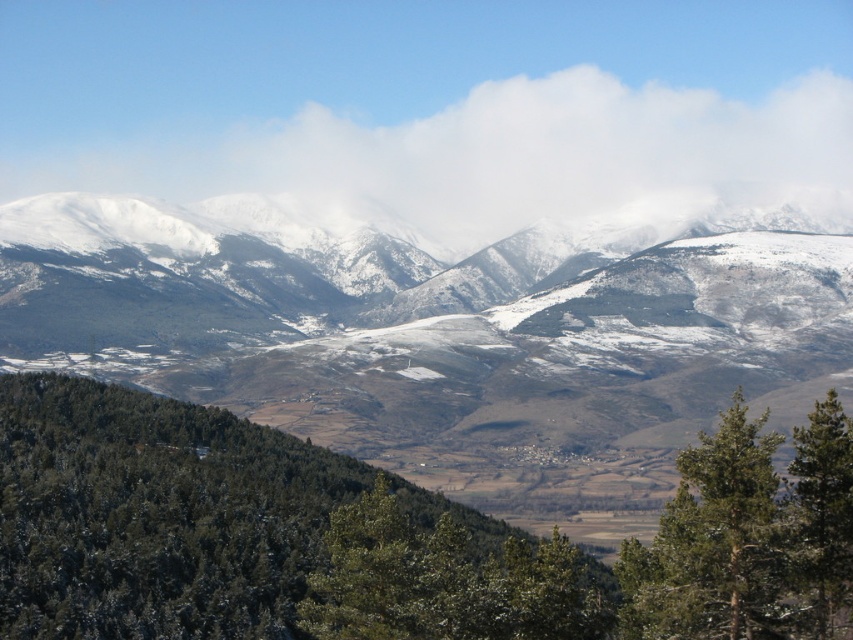
What do you see at coordinates (560, 160) in the screenshot? The height and width of the screenshot is (640, 853). I see `white fluffy cloud at upper center` at bounding box center [560, 160].

Is white fluffy cloud at upper center thinner than green textured tree at lower right?

No, white fluffy cloud at upper center is not thinner than green textured tree at lower right.

Is point (375, 131) behind point (850, 548)?

Yes, point (375, 131) is farther from viewer.

Locate an element on the screen. Image resolution: width=853 pixels, height=640 pixels. white fluffy cloud at upper center is located at coordinates (560, 160).

Between point (468, 260) and point (683, 577), which one is positioned behind?

Positioned behind is point (468, 260).

Can you confirm if snowy rocky mountain range at center is bigger than green needle-like tree at lower right?

Yes.

Is point (602, 332) behind point (630, 602)?

Yes, it is.

Locate an element on the screen. The image size is (853, 640). snowy rocky mountain range at center is located at coordinates (444, 339).

Who is positioned more to the left, green needle-like tree at lower right or green textured tree at lower right?

From the viewer's perspective, green needle-like tree at lower right appears more on the left side.

Between point (682, 513) and point (821, 506), which one is positioned behind?

Positioned behind is point (682, 513).

This screenshot has height=640, width=853. In order to click on green needle-like tree at lower right in this screenshot , I will do `click(712, 544)`.